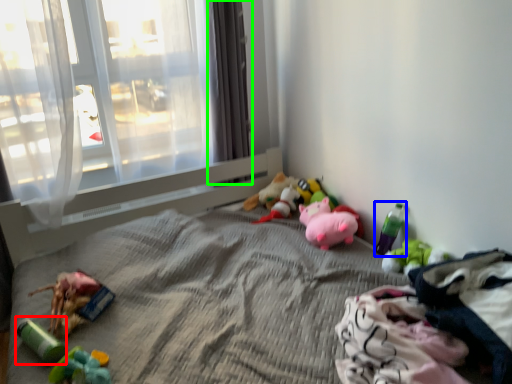
Question: Estimate the real-world distances between objects in this image. Which object is closer to toy (highlighted by a red box), toy (highlighted by a blue box) or curtain (highlighted by a green box)?

Choices:
 (A) toy
 (B) curtain

Answer: (A)